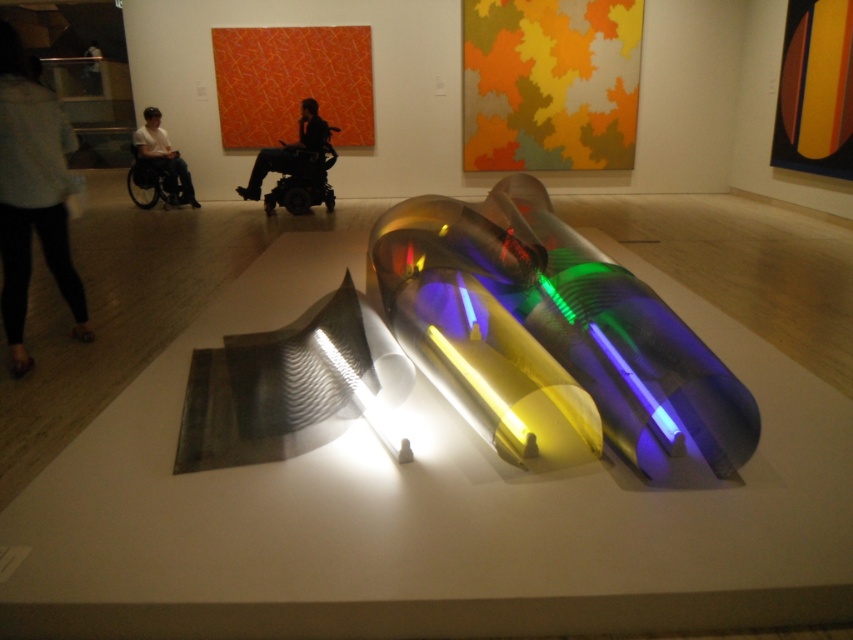
You are an art enthusiast visiting the gallery and want to take a photo of the sculpture. You notice the light gray fabric pants at left and the black matte wheelchair at center are in your shot. Which object is narrower so you can decide if you need to move them to frame the sculpture better?

The light gray fabric pants at left has a lesser width compared to the black matte wheelchair at center, so it is narrower. You may need to adjust the wheelchair to frame the sculpture better since it is wider.